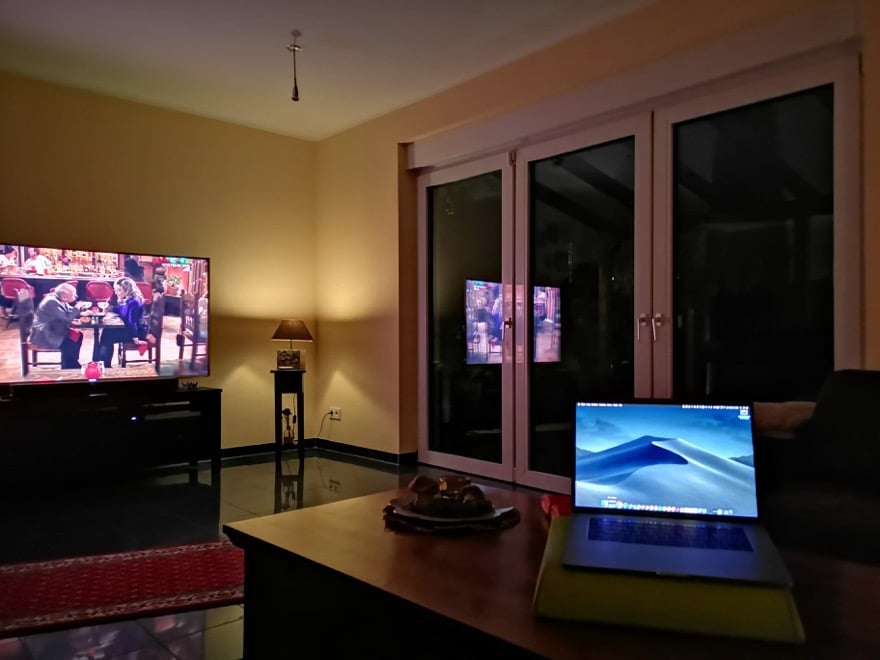
In order to click on tv in this screenshot , I will do `click(554, 321)`.